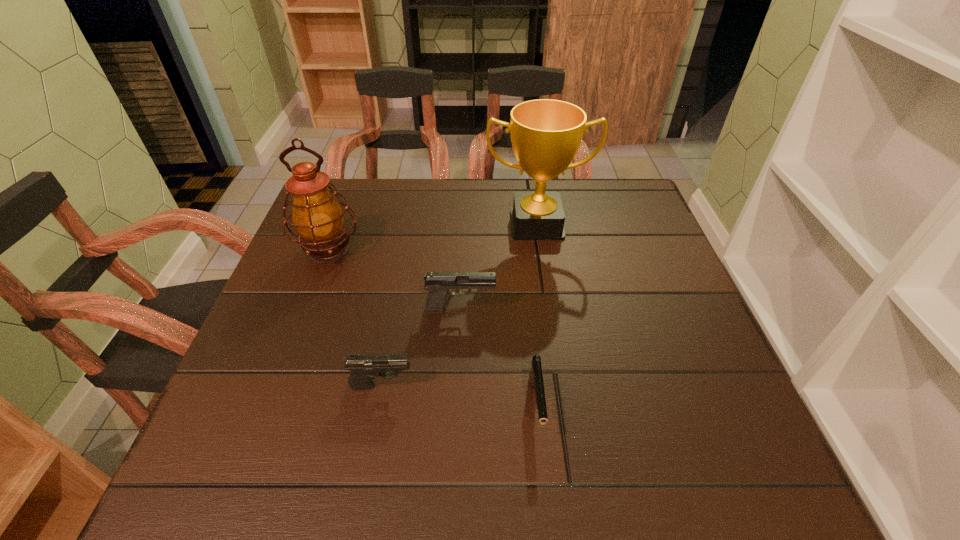
The height and width of the screenshot is (540, 960). I want to click on vacant area that lies between the rightmost pistol and the award, so (x=537, y=316).

Find the location of a particular element. The image size is (960, 540). empty space that is in between the farthest pistol and the oil lamp is located at coordinates (395, 280).

Where is `free area in between the third shortest object and the fourth object from right to left`? This screenshot has width=960, height=540. free area in between the third shortest object and the fourth object from right to left is located at coordinates (421, 347).

Where is `free space between the rightmost pistol and the leftmost pistol`? The image size is (960, 540). free space between the rightmost pistol and the leftmost pistol is located at coordinates (459, 396).

Identify the location of free space between the third shortest object and the oil lamp. The height and width of the screenshot is (540, 960). (395, 280).

You are a GUI agent. You are given a task and a screenshot of the screen. Output one action in this format:
    pyautogui.click(x=<x>, y=<y>)
    Task: Click on the blank region between the award and the rightmost pistol
    
    Given the screenshot: What is the action you would take?
    pyautogui.click(x=537, y=316)

Locate an element on the screen. The image size is (960, 540). empty space between the fourth object from right to left and the award is located at coordinates (459, 305).

Locate an element on the screen. This screenshot has width=960, height=540. free space between the award and the leftmost object is located at coordinates (433, 238).

This screenshot has width=960, height=540. What are the coordinates of `object that stands as the closest to the leftmost pistol` in the screenshot? It's located at (438, 284).

Select which object appears as the closest to the tallest pistol. Please provide its 2D coordinates. Your answer should be formatted as a tuple, i.e. [(x, y)], where the tuple contains the x and y coordinates of a point satisfying the conditions above.

[(364, 368)]